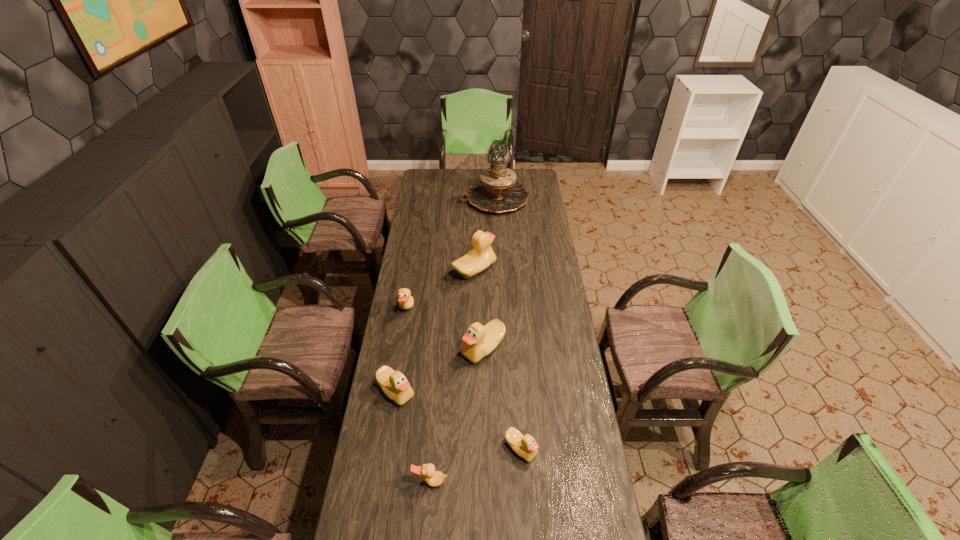
The image size is (960, 540). Find the location of `the nearest beige duck`. the nearest beige duck is located at coordinates (526, 447).

Locate an element on the screen. The image size is (960, 540). the smallest beige duck is located at coordinates (526, 447).

At what (x,y) coordinates should I click in order to perform the action: click on the smaller tan duck. Please return your answer as a coordinate pair (x, y). Looking at the image, I should click on (433, 478).

You are a GUI agent. You are given a task and a screenshot of the screen. Output one action in this format:
    pyautogui.click(x=<x>, y=<y>)
    Task: Click on the right tan duck
    The image size is (960, 540).
    Given the screenshot: What is the action you would take?
    pyautogui.click(x=433, y=478)

Identify the location of vacant area situated on the front of the oil lamp. (496, 230).

Image resolution: width=960 pixels, height=540 pixels. I want to click on free point located at the beak of the biggest beige duck, so click(x=544, y=271).

Where is `vacant region located at the beak of the second farthest beige duck`? Image resolution: width=960 pixels, height=540 pixels. vacant region located at the beak of the second farthest beige duck is located at coordinates [x=434, y=349].

Locate an element on the screen. This screenshot has height=540, width=960. vacant space located at the beak of the second farthest beige duck is located at coordinates (395, 349).

Identify the location of vacant area situated 0.290m at the beak of the second farthest beige duck. This screenshot has width=960, height=540. (389, 349).

The height and width of the screenshot is (540, 960). Identify the location of free space located 0.150m at the beak of the second nearest beige duck. (387, 449).